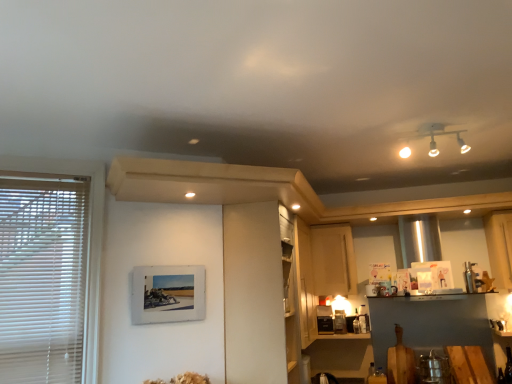
Measure the distance between point (150,282) and camera.

A distance of 2.36 meters exists between point (150,282) and camera.

The height and width of the screenshot is (384, 512). In order to click on light wood cabinet at center, positioned as the second cabinetry in front-to-back order in this screenshot , I will do `click(333, 260)`.

This screenshot has width=512, height=384. What do you see at coordinates (88, 242) in the screenshot?
I see `white blinds at left` at bounding box center [88, 242].

Find the location of `white blinds at left`. white blinds at left is located at coordinates (88, 242).

Locate an element on the screen. satin black toaster at lower center is located at coordinates (325, 319).

Where is `wooden picture frame at lower left`? wooden picture frame at lower left is located at coordinates (167, 294).

Which of these two, wooden picture frame at lower left or light wood cabinet at center, marked as the 1th cabinetry in a back-to-front arrangement, is smaller?

With smaller size is wooden picture frame at lower left.

Are wooden picture frame at lower left and light wood cabinet at center, positioned as the 2th cabinetry in left-to-right order, far apart?

Indeed, wooden picture frame at lower left is not near light wood cabinet at center, positioned as the 2th cabinetry in left-to-right order.

Is light wood cabinet at center, which appears as the first cabinetry when viewed from the right, completely or partially inside wooden picture frame at lower left?

Actually, light wood cabinet at center, which appears as the first cabinetry when viewed from the right, is outside wooden picture frame at lower left.

Measure the distance between white matte cabinet at center, which appears as the second cabinetry when viewed from the back, and satin black toaster at lower center.

white matte cabinet at center, which appears as the second cabinetry when viewed from the back, is 1.24 meters from satin black toaster at lower center.

Between white matte cabinet at center, which is the 2th cabinetry from right to left, and satin black toaster at lower center, which one appears on the left side from the viewer's perspective?

white matte cabinet at center, which is the 2th cabinetry from right to left, is more to the left.

From the image's perspective, between white matte cabinet at center, the first cabinetry when ordered from front to back, and satin black toaster at lower center, who is located below?

satin black toaster at lower center appears lower in the image.

Can you see white matte cabinet at center, marked as the 1th cabinetry in a left-to-right arrangement, touching satin black toaster at lower center?

No, white matte cabinet at center, marked as the 1th cabinetry in a left-to-right arrangement, is not touching satin black toaster at lower center.

Looking at this image, from a real-world perspective, who is located higher, white matte cabinet at center, the first cabinetry when ordered from front to back, or white blinds at left?

white blinds at left, from a real-world perspective.

Considering the sizes of white matte cabinet at center, marked as the 1th cabinetry in a left-to-right arrangement, and white blinds at left in the image, is white matte cabinet at center, marked as the 1th cabinetry in a left-to-right arrangement, bigger or smaller than white blinds at left?

In the image, white matte cabinet at center, marked as the 1th cabinetry in a left-to-right arrangement, appears to be larger than white blinds at left.

Based on the photo, between white matte cabinet at center, which appears as the second cabinetry when viewed from the back, and white blinds at left, which one has smaller width?

With smaller width is white blinds at left.

Does point (278, 289) lie in front of point (91, 348)?

No, (278, 289) is further to viewer.

Is white blinds at left facing away from wooden picture frame at lower left?

No, white blinds at left's orientation is not away from wooden picture frame at lower left.

Between white blinds at left and wooden picture frame at lower left, which one has smaller size?

With smaller size is wooden picture frame at lower left.

Is point (98, 240) closer or farther from the camera than point (165, 267)?

Clearly, point (98, 240) is closer to the camera than point (165, 267).

Is white blinds at left to the left of wooden picture frame at lower left from the viewer's perspective?

Correct, you'll find white blinds at left to the left of wooden picture frame at lower left.

Considering the relative sizes of light wood cabinet at center, positioned as the second cabinetry in front-to-back order, and white blinds at left in the image provided, is light wood cabinet at center, positioned as the second cabinetry in front-to-back order, wider than white blinds at left?

Indeed, light wood cabinet at center, positioned as the second cabinetry in front-to-back order, has a greater width compared to white blinds at left.

Considering the relative positions of light wood cabinet at center, marked as the 1th cabinetry in a back-to-front arrangement, and white blinds at left in the image provided, is light wood cabinet at center, marked as the 1th cabinetry in a back-to-front arrangement, to the left or to the right of white blinds at left?

From the image, it's evident that light wood cabinet at center, marked as the 1th cabinetry in a back-to-front arrangement, is to the right of white blinds at left.

From the image's perspective, is light wood cabinet at center, positioned as the second cabinetry in front-to-back order, on top of white blinds at left?

No.

Considering the positions of objects light wood cabinet at center, positioned as the 2th cabinetry in left-to-right order, and white blinds at left in the image provided, who is behind, light wood cabinet at center, positioned as the 2th cabinetry in left-to-right order, or white blinds at left?

light wood cabinet at center, positioned as the 2th cabinetry in left-to-right order, is further away from the camera.

Does white matte cabinet at center, marked as the 1th cabinetry in a left-to-right arrangement, have a greater width compared to wooden picture frame at lower left?

Yes.

From the image's perspective, which cabinetry is the 2nd one below the wooden picture frame at lower left? Please provide its 2D coordinates.

[(260, 295)]

From the image's perspective, is white matte cabinet at center, the first cabinetry when ordered from front to back, over wooden picture frame at lower left?

No, from the image's perspective, white matte cabinet at center, the first cabinetry when ordered from front to back, is not over wooden picture frame at lower left.

Is white matte cabinet at center, the first cabinetry when ordered from front to back, not inside wooden picture frame at lower left?

Yes.

Does point (321, 320) come farther from viewer compared to point (288, 264)?

Yes.

From a real-world perspective, is satin black toaster at lower center positioned over white matte cabinet at center, the first cabinetry when ordered from front to back, based on gravity?

No, from a real-world perspective, satin black toaster at lower center is not on top of white matte cabinet at center, the first cabinetry when ordered from front to back.

Is satin black toaster at lower center not close to white matte cabinet at center, marked as the 1th cabinetry in a left-to-right arrangement?

That's right, there is a large distance between satin black toaster at lower center and white matte cabinet at center, marked as the 1th cabinetry in a left-to-right arrangement.

You are a GUI agent. You are given a task and a screenshot of the screen. Output one action in this format:
    pyautogui.click(x=<x>, y=<y>)
    Task: Click on the picture frame beneath the light wood cabinet at center, which appears as the first cabinetry when viewed from the right (from a real-world perspective)
    The height and width of the screenshot is (384, 512).
    Given the screenshot: What is the action you would take?
    pyautogui.click(x=167, y=294)

Locate an element on the screen. Image resolution: width=512 pixels, height=384 pixels. the 2nd cabinetry in front of the satin black toaster at lower center, starting your count from the anchor is located at coordinates (260, 295).

Which object lies nearer to the anchor point white blinds at left, white matte cabinet at center, which appears as the second cabinetry when viewed from the back, or satin black toaster at lower center?

white matte cabinet at center, which appears as the second cabinetry when viewed from the back, lies closer to white blinds at left than the other object.

From the image, which object appears to be nearer to light wood cabinet at center, which appears as the first cabinetry when viewed from the right, white matte cabinet at center, the first cabinetry when ordered from front to back, or white blinds at left?

Based on the image, white matte cabinet at center, the first cabinetry when ordered from front to back, appears to be nearer to light wood cabinet at center, which appears as the first cabinetry when viewed from the right.

From the image, which object appears to be farther from light wood cabinet at center, positioned as the second cabinetry in front-to-back order, satin black toaster at lower center or white matte cabinet at center, the first cabinetry when ordered from front to back?

The object further to light wood cabinet at center, positioned as the second cabinetry in front-to-back order, is white matte cabinet at center, the first cabinetry when ordered from front to back.

Estimate the real-world distances between objects in this image. Which object is closer to light wood cabinet at center, positioned as the 2th cabinetry in left-to-right order, wooden picture frame at lower left or satin black toaster at lower center?

Based on the image, satin black toaster at lower center appears to be nearer to light wood cabinet at center, positioned as the 2th cabinetry in left-to-right order.

Which object lies nearer to the anchor point white matte cabinet at center, which is the 2th cabinetry from right to left, wooden picture frame at lower left or light wood cabinet at center, positioned as the second cabinetry in front-to-back order?

Based on the image, wooden picture frame at lower left appears to be nearer to white matte cabinet at center, which is the 2th cabinetry from right to left.

Based on the photo, when comparing their distances from light wood cabinet at center, positioned as the second cabinetry in front-to-back order, does wooden picture frame at lower left or white matte cabinet at center, marked as the 1th cabinetry in a left-to-right arrangement, seem closer?

white matte cabinet at center, marked as the 1th cabinetry in a left-to-right arrangement, is positioned closer to the anchor light wood cabinet at center, positioned as the second cabinetry in front-to-back order.

Looking at the image, which one is located closer to wooden picture frame at lower left, light wood cabinet at center, which appears as the first cabinetry when viewed from the right, or white matte cabinet at center, which appears as the second cabinetry when viewed from the back?

white matte cabinet at center, which appears as the second cabinetry when viewed from the back.

Which object lies further to the anchor point light wood cabinet at center, positioned as the second cabinetry in front-to-back order, wooden picture frame at lower left or white blinds at left?

The object further to light wood cabinet at center, positioned as the second cabinetry in front-to-back order, is white blinds at left.

Find the location of `cabinetry located between white matte cabinet at center, which is the 2th cabinetry from right to left, and satin black toaster at lower center in the depth direction`. cabinetry located between white matte cabinet at center, which is the 2th cabinetry from right to left, and satin black toaster at lower center in the depth direction is located at coordinates (333, 260).

At what (x,y) coordinates should I click in order to perform the action: click on picture frame between white blinds at left and light wood cabinet at center, positioned as the 2th cabinetry in left-to-right order. Please return your answer as a coordinate pair (x, y). Looking at the image, I should click on (167, 294).

Identify the location of picture frame between white blinds at left and satin black toaster at lower center in the horizontal direction. (167, 294).

Locate an element on the screen. The width and height of the screenshot is (512, 384). cabinetry between white blinds at left and satin black toaster at lower center is located at coordinates (260, 295).